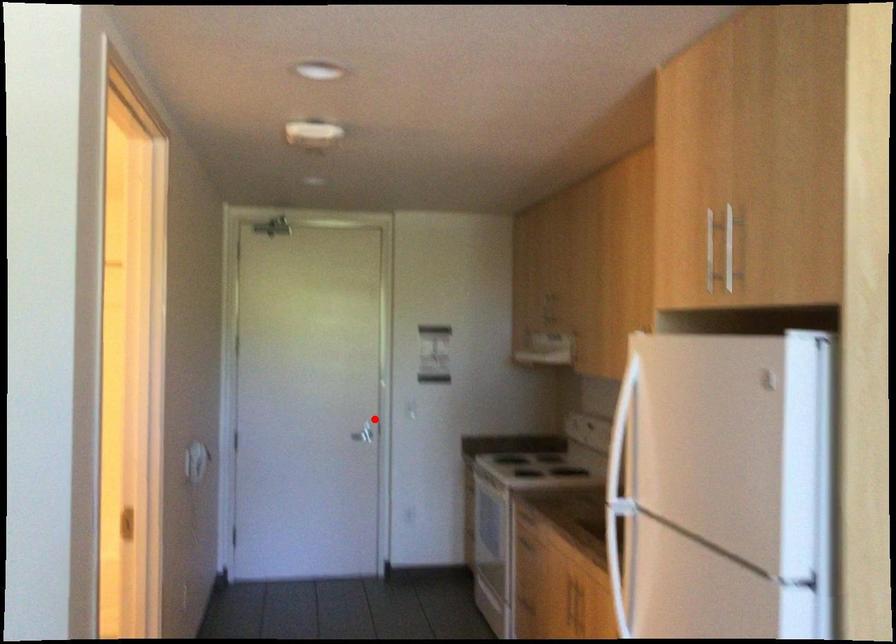
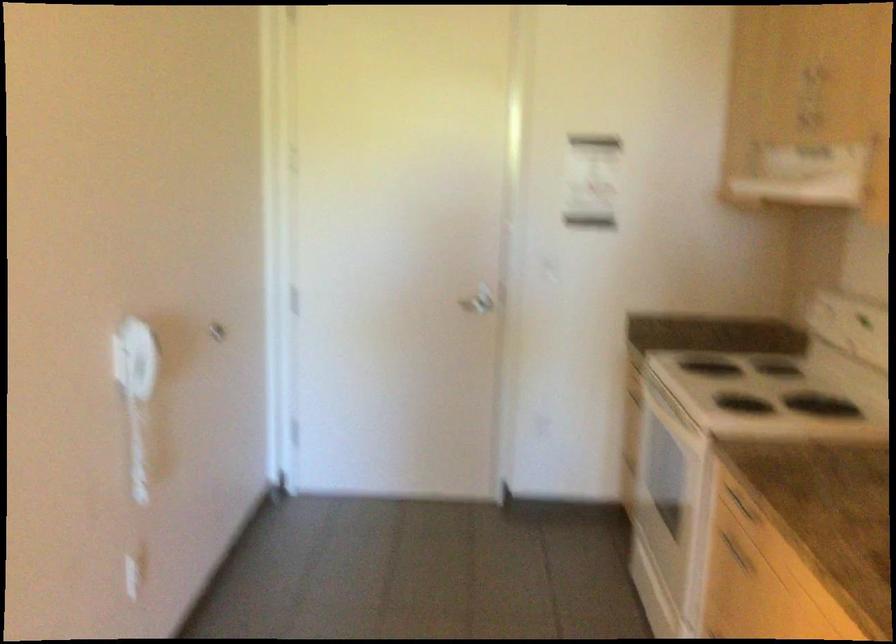
Question: A red point is marked in image1. In image2, is the corresponding 3D point closer to the camera or farther? Reply with the corresponding letter.

Choices:
 (A) The corresponding 3D point is closer.
 (B) The corresponding 3D point is farther.

Answer: (A)